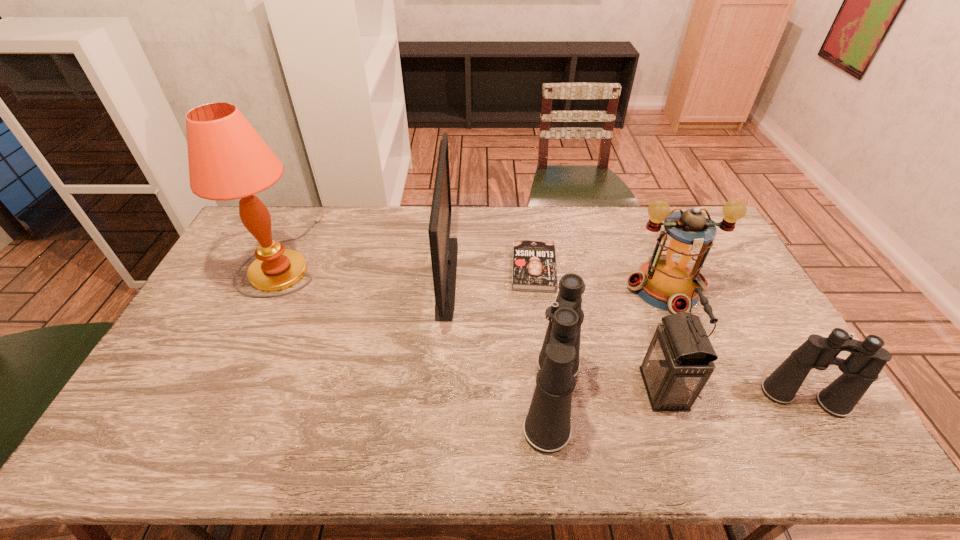
What are the coordinates of `lantern that is at the near edge` in the screenshot? It's located at (679, 361).

Locate an element on the screen. object at the left edge is located at coordinates (228, 160).

Identify the location of binoculars positioned at the right edge. The image size is (960, 540). (861, 368).

Locate an element on the screen. The image size is (960, 540). lantern that is at the right edge is located at coordinates (667, 281).

Locate an element on the screen. The width and height of the screenshot is (960, 540). object that is at the far left corner is located at coordinates (228, 160).

Where is `object present at the near right corner`? The height and width of the screenshot is (540, 960). object present at the near right corner is located at coordinates (861, 368).

In the image, there is a desktop. Identify the location of blank space at the far edge. The image size is (960, 540). (530, 237).

Where is `vacant space at the near edge of the desktop`? Image resolution: width=960 pixels, height=540 pixels. vacant space at the near edge of the desktop is located at coordinates (313, 416).

Identify the location of free spot at the left edge of the desktop. (248, 291).

Image resolution: width=960 pixels, height=540 pixels. I want to click on vacant position at the right edge of the desktop, so click(710, 268).